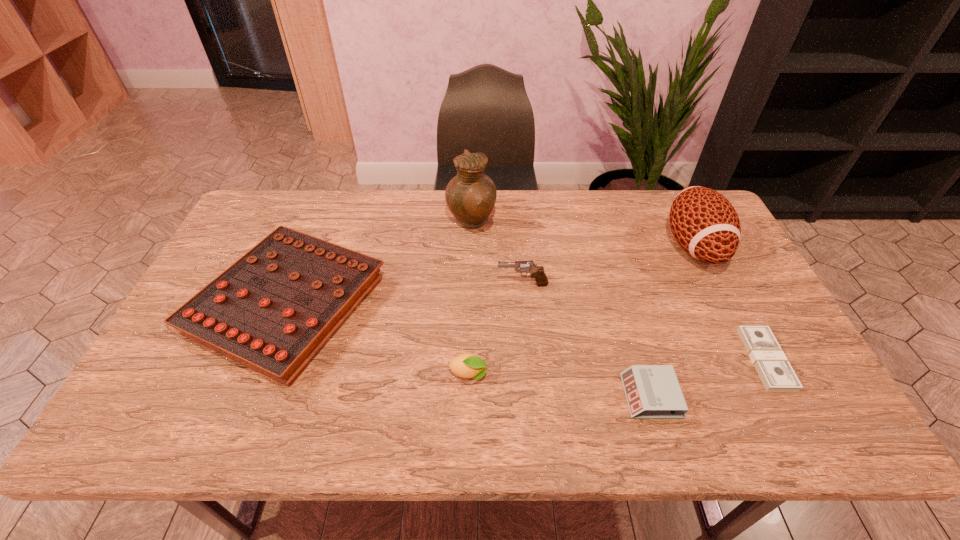
At what (x,y) coordinates should I click in order to perform the action: click on vacant area between the football and the tallest object. Please return your answer as a coordinate pair (x, y). Image resolution: width=960 pixels, height=540 pixels. Looking at the image, I should click on (583, 234).

The height and width of the screenshot is (540, 960). Identify the location of empty space that is in between the dollar and the fifth shortest object. (644, 322).

This screenshot has height=540, width=960. In order to click on vacant area that lies between the sixth shortest object and the third object from right to left in this screenshot , I will do `click(672, 321)`.

What are the coordinates of `unoccupied position between the gameboard and the alarm clock` in the screenshot? It's located at (469, 352).

Where is `free space that is in between the alarm clock and the pitcher`? This screenshot has height=540, width=960. free space that is in between the alarm clock and the pitcher is located at coordinates (561, 309).

Where is `empty location between the lemon and the gameboard`? The image size is (960, 540). empty location between the lemon and the gameboard is located at coordinates (379, 341).

Find the location of a particular element. The image size is (960, 540). vacant space in between the lemon and the pitcher is located at coordinates (470, 298).

This screenshot has width=960, height=540. I want to click on blank region between the second shortest object and the second tallest object, so click(672, 321).

Where is `free area in between the fifth object from left to right and the lemon`? The width and height of the screenshot is (960, 540). free area in between the fifth object from left to right and the lemon is located at coordinates (560, 385).

The width and height of the screenshot is (960, 540). I want to click on free space between the second shortest object and the third tallest object, so click(587, 340).